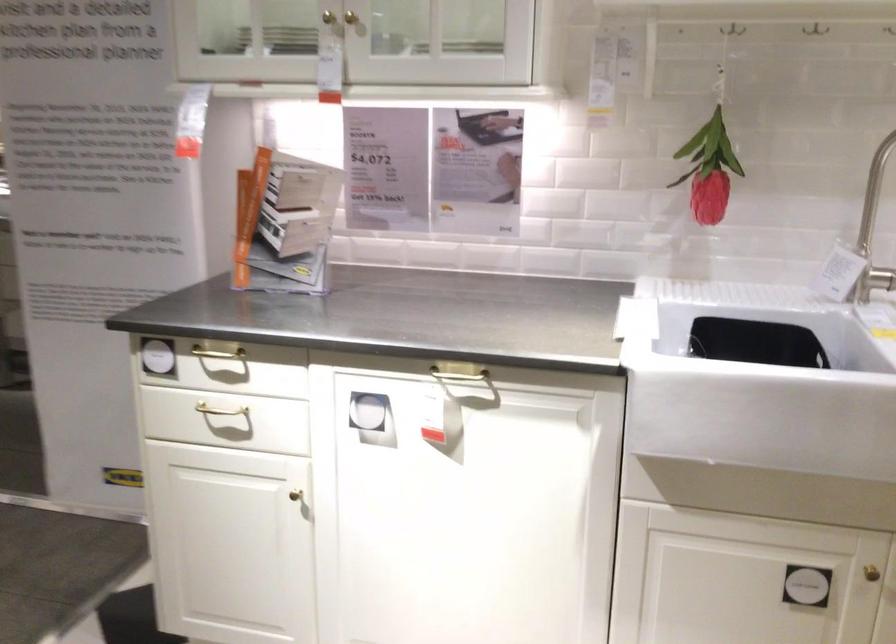
Find where to pull the gold cabinet handle. Please return your answer as a coordinate pair (x, y).

(357, 41)